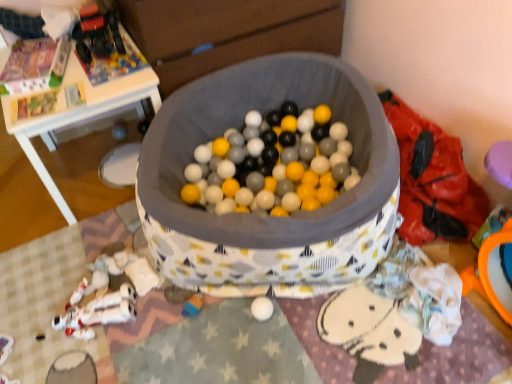
Image resolution: width=512 pixels, height=384 pixels. Describe the element at coordinates (80, 115) in the screenshot. I see `white plastic table at upper left` at that location.

The height and width of the screenshot is (384, 512). Describe the element at coordinates (108, 293) in the screenshot. I see `white plastic toy at lower left, the 2th toy ordered from the bottom` at that location.

Where is `white matte plastic toy at lower left, placed as the second toy when sorted from top to bottom`? This screenshot has height=384, width=512. white matte plastic toy at lower left, placed as the second toy when sorted from top to bottom is located at coordinates (123, 272).

Can you confirm if white plastic table at upper left is thinner than white matte plastic toy at lower left, placed as the second toy when sorted from top to bottom?

No, white plastic table at upper left is not thinner than white matte plastic toy at lower left, placed as the second toy when sorted from top to bottom.

Between point (67, 217) and point (98, 275), which one is positioned behind?

The point (67, 217) is farther.

Would you say white plastic table at upper left is outside white matte plastic toy at lower left, the 3th toy positioned from the bottom?

Yes, white plastic table at upper left is not within white matte plastic toy at lower left, the 3th toy positioned from the bottom.

Which object is closer to the camera taking this photo, white matte plastic toy at lower left, the 3th toy positioned from the bottom, or metallic plastic toy truck at upper left, which appears as the fourth toy when ordered from the bottom?

white matte plastic toy at lower left, the 3th toy positioned from the bottom, is more forward.

Does white matte plastic toy at lower left, placed as the second toy when sorted from top to bottom, have a lesser width compared to metallic plastic toy truck at upper left, arranged as the first toy when viewed from the top?

Indeed, white matte plastic toy at lower left, placed as the second toy when sorted from top to bottom, has a lesser width compared to metallic plastic toy truck at upper left, arranged as the first toy when viewed from the top.

Is white matte plastic toy at lower left, placed as the second toy when sorted from top to bottom, bigger than metallic plastic toy truck at upper left, which appears as the fourth toy when ordered from the bottom?

No, white matte plastic toy at lower left, placed as the second toy when sorted from top to bottom, is not bigger than metallic plastic toy truck at upper left, which appears as the fourth toy when ordered from the bottom.

Is metallic plastic toy truck at upper left, which appears as the fourth toy when ordered from the bottom, completely or partially inside white plastic table at upper left?

Definitely not — metallic plastic toy truck at upper left, which appears as the fourth toy when ordered from the bottom, is not inside white plastic table at upper left.

Is white plastic table at upper left in front of or behind metallic plastic toy truck at upper left, arranged as the first toy when viewed from the top, in the image?

Clearly, white plastic table at upper left is in front of metallic plastic toy truck at upper left, arranged as the first toy when viewed from the top.

In the image, there is a white plastic table at upper left. Where is `toy above it (from the image's perspective)`? The image size is (512, 384). toy above it (from the image's perspective) is located at coordinates (97, 34).

How different are the orientations of metallic plastic toy truck at upper left, which appears as the fourth toy when ordered from the bottom, and white plastic table at upper left in degrees?

4.36 degrees.

From a real-world perspective, is metallic plastic toy truck at upper left, arranged as the first toy when viewed from the top, positioned above or below white plastic table at upper left?

From a real-world perspective, metallic plastic toy truck at upper left, arranged as the first toy when viewed from the top, is physically above white plastic table at upper left.

Is metallic plastic toy truck at upper left, arranged as the first toy when viewed from the top, positioned with its back to white plastic table at upper left?

No, metallic plastic toy truck at upper left, arranged as the first toy when viewed from the top, is not facing the opposite direction of white plastic table at upper left.

Between metallic plastic toy truck at upper left, arranged as the first toy when viewed from the top, and white plastic table at upper left, which one has larger size?

Bigger between the two is white plastic table at upper left.

From the image's perspective, would you say white plastic toy at lower left, the 2th toy ordered from the bottom, is shown under white plastic table at upper left?

Yes.

Does white plastic toy at lower left, placed as the third toy when sorted from top to bottom, appear on the right side of white plastic table at upper left?

Yes.

From a real-world perspective, which object stands above the other?

white plastic table at upper left, from a real-world perspective.

Where is `table that appears on the left of white plastic toy at lower left, placed as the third toy when sorted from top to bottom`? The width and height of the screenshot is (512, 384). table that appears on the left of white plastic toy at lower left, placed as the third toy when sorted from top to bottom is located at coordinates tap(80, 115).

Which object is positioned more to the left, rubberized plastic toy at lower center, positioned as the 1th toy in bottom-to-top order, or white plastic toy at lower left, the 2th toy ordered from the bottom?

Positioned to the left is white plastic toy at lower left, the 2th toy ordered from the bottom.

Identify the location of the 2nd toy to the right of the white plastic toy at lower left, placed as the third toy when sorted from top to bottom, starting your count from the anchor. Image resolution: width=512 pixels, height=384 pixels. (193, 305).

Is rubberized plastic toy at lower center, positioned as the 1th toy in bottom-to-top order, facing away from white plastic toy at lower left, placed as the third toy when sorted from top to bottom?

rubberized plastic toy at lower center, positioned as the 1th toy in bottom-to-top order, does not have its back to white plastic toy at lower left, placed as the third toy when sorted from top to bottom.

Which is behind, point (203, 301) or point (113, 258)?

Positioned behind is point (113, 258).

From the image's perspective, which one is positioned lower, white plastic table at upper left or white plastic toy at lower left, the 2th toy ordered from the bottom?

From the image's view, white plastic toy at lower left, the 2th toy ordered from the bottom, is below.

Is white plastic table at upper left bigger than white plastic toy at lower left, the 2th toy ordered from the bottom?

Correct, white plastic table at upper left is larger in size than white plastic toy at lower left, the 2th toy ordered from the bottom.

From the picture: Is white plastic table at upper left to the right of white plastic toy at lower left, the 2th toy ordered from the bottom, from the viewer's perspective?

No, white plastic table at upper left is not to the right of white plastic toy at lower left, the 2th toy ordered from the bottom.

Is white plastic table at upper left far away from white plastic toy at lower left, placed as the third toy when sorted from top to bottom?

That's not correct — white plastic table at upper left is a little close to white plastic toy at lower left, placed as the third toy when sorted from top to bottom.

Locate an element on the screen. table located above the white matte plastic toy at lower left, placed as the second toy when sorted from top to bottom (from a real-world perspective) is located at coordinates (80, 115).

Locate an element on the screen. The image size is (512, 384). toy that is the 2nd object to the right of the metallic plastic toy truck at upper left, arranged as the first toy when viewed from the top, starting at the anchor is located at coordinates (123, 272).

Looking at the image, which one is located further to metallic plastic toy truck at upper left, arranged as the first toy when viewed from the top, white matte plastic toy at lower left, the 3th toy positioned from the bottom, or rubberized plastic toy at lower center, the fourth toy viewed from the top?

rubberized plastic toy at lower center, the fourth toy viewed from the top, is further to metallic plastic toy truck at upper left, arranged as the first toy when viewed from the top.

Estimate the real-world distances between objects in this image. Which object is further from white plastic table at upper left, white plastic toy at lower left, the 2th toy ordered from the bottom, or white matte plastic toy at lower left, placed as the second toy when sorted from top to bottom?

white matte plastic toy at lower left, placed as the second toy when sorted from top to bottom, is further to white plastic table at upper left.

Which object lies nearer to the anchor point white plastic table at upper left, white plastic toy at lower left, placed as the third toy when sorted from top to bottom, or rubberized plastic toy at lower center, positioned as the 1th toy in bottom-to-top order?

Among the two, white plastic toy at lower left, placed as the third toy when sorted from top to bottom, is located nearer to white plastic table at upper left.

In the scene shown: Considering their positions, is white plastic table at upper left positioned further to white plastic toy at lower left, placed as the third toy when sorted from top to bottom, than metallic plastic toy truck at upper left, which appears as the fourth toy when ordered from the bottom?

metallic plastic toy truck at upper left, which appears as the fourth toy when ordered from the bottom.

Looking at the image, which one is located further to white matte plastic toy at lower left, placed as the second toy when sorted from top to bottom, metallic plastic toy truck at upper left, which appears as the fourth toy when ordered from the bottom, or white plastic table at upper left?

Based on the image, metallic plastic toy truck at upper left, which appears as the fourth toy when ordered from the bottom, appears to be further to white matte plastic toy at lower left, placed as the second toy when sorted from top to bottom.

Based on their spatial positions, is white matte plastic toy at lower left, placed as the second toy when sorted from top to bottom, or white plastic toy at lower left, placed as the third toy when sorted from top to bottom, further from white plastic table at upper left?

white matte plastic toy at lower left, placed as the second toy when sorted from top to bottom, is positioned further to the anchor white plastic table at upper left.

From the image, which object appears to be nearer to rubberized plastic toy at lower center, the fourth toy viewed from the top, white matte plastic toy at lower left, the 3th toy positioned from the bottom, or white plastic toy at lower left, placed as the third toy when sorted from top to bottom?

Based on the image, white matte plastic toy at lower left, the 3th toy positioned from the bottom, appears to be nearer to rubberized plastic toy at lower center, the fourth toy viewed from the top.

Based on the photo, from the image, which object appears to be farther from rubberized plastic toy at lower center, positioned as the 1th toy in bottom-to-top order, white plastic toy at lower left, the 2th toy ordered from the bottom, or metallic plastic toy truck at upper left, which appears as the fourth toy when ordered from the bottom?

Among the two, metallic plastic toy truck at upper left, which appears as the fourth toy when ordered from the bottom, is located further to rubberized plastic toy at lower center, positioned as the 1th toy in bottom-to-top order.

Find the location of a particular element. The width and height of the screenshot is (512, 384). table between metallic plastic toy truck at upper left, which appears as the fourth toy when ordered from the bottom, and rubberized plastic toy at lower center, the fourth toy viewed from the top, vertically is located at coordinates point(80,115).

This screenshot has height=384, width=512. Find the location of `toy between metallic plastic toy truck at upper left, which appears as the fourth toy when ordered from the bottom, and white plastic toy at lower left, the 2th toy ordered from the bottom, from top to bottom`. toy between metallic plastic toy truck at upper left, which appears as the fourth toy when ordered from the bottom, and white plastic toy at lower left, the 2th toy ordered from the bottom, from top to bottom is located at coordinates (123, 272).

Locate an element on the screen. toy between white plastic toy at lower left, the 2th toy ordered from the bottom, and rubberized plastic toy at lower center, the fourth toy viewed from the top, from left to right is located at coordinates pyautogui.click(x=123, y=272).

Locate an element on the screen. This screenshot has height=384, width=512. table between metallic plastic toy truck at upper left, which appears as the fourth toy when ordered from the bottom, and white matte plastic toy at lower left, the 3th toy positioned from the bottom, in the vertical direction is located at coordinates (80, 115).